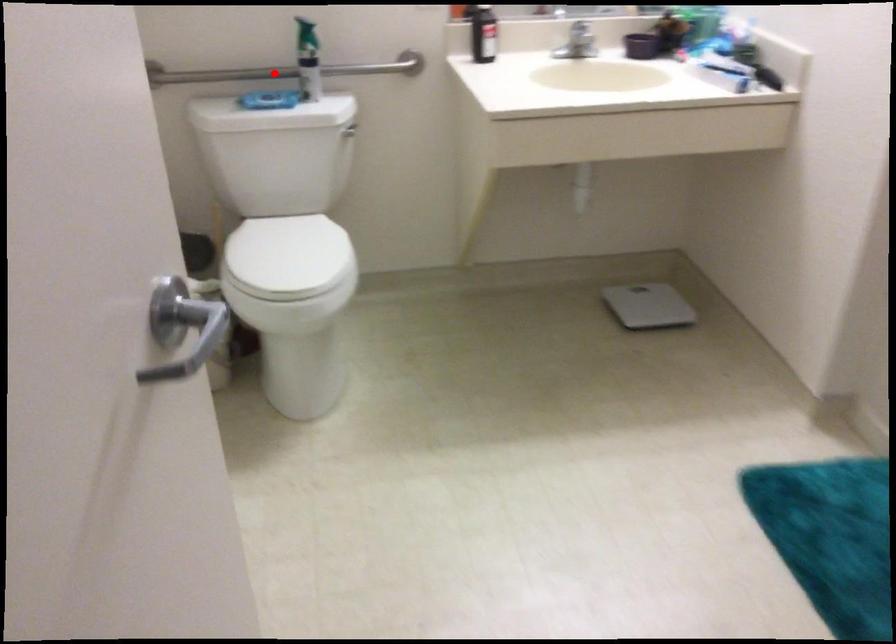
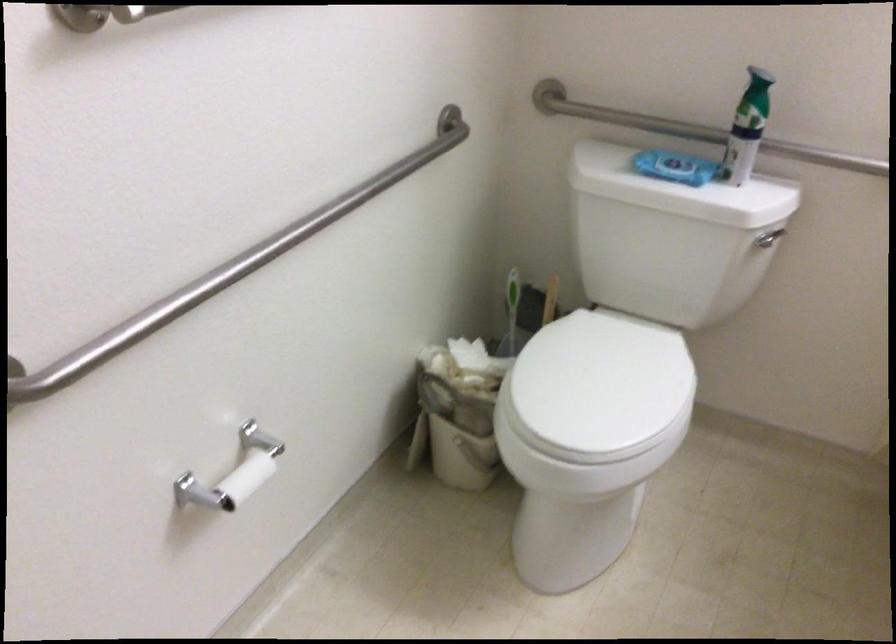
Question: I am providing you with two images of the same scene from different viewpoints. Given a red point in image1, look at the same physical point in image2. Is it:

Choices:
 (A) Closer to the viewpoint
 (B) Farther from the viewpoint

Answer: (A)